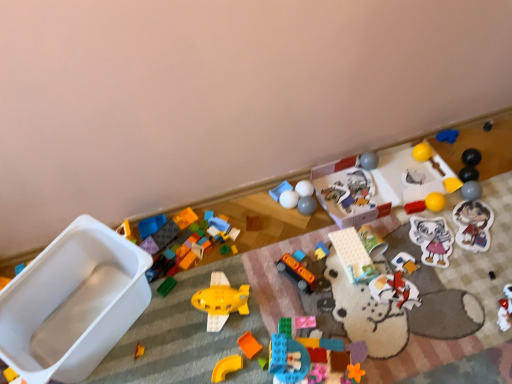
What are the coordinates of `free space above white matte figure at center, the nineteenth toy viewed from the left (from a real-world perspective)` in the screenshot? It's located at (x=395, y=276).